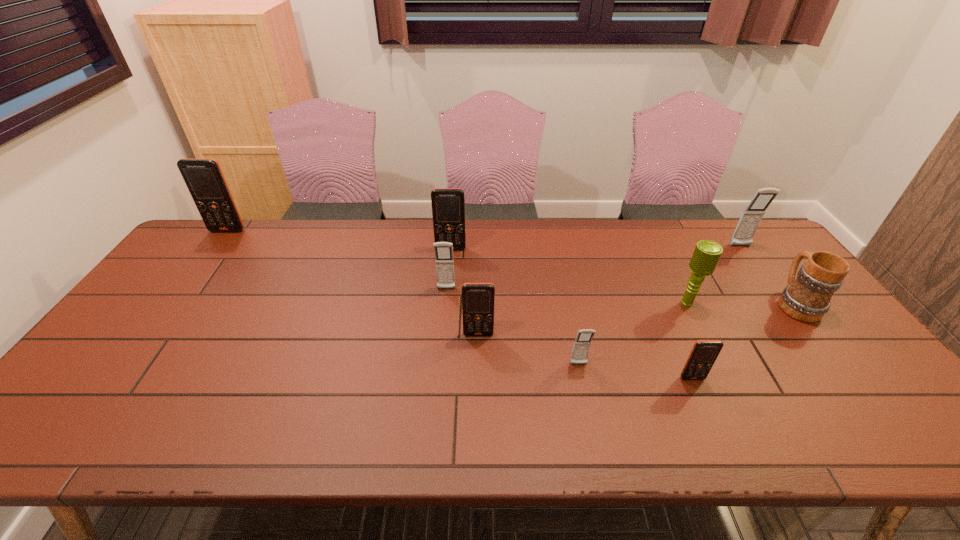
The height and width of the screenshot is (540, 960). In order to click on the third orange cellular telephone from left to right in this screenshot , I will do `click(478, 299)`.

Where is `mug`? The image size is (960, 540). mug is located at coordinates (807, 298).

I want to click on the rightmost orange cellular telephone, so click(704, 353).

Identify the location of the smallest orange cellular telephone. Image resolution: width=960 pixels, height=540 pixels. (704, 353).

What are the coordinates of `the smallest gray cellular telephone` in the screenshot? It's located at (582, 343).

You are a GUI agent. You are given a task and a screenshot of the screen. Output one action in this format:
    pyautogui.click(x=<x>, y=<y>)
    Task: Click on the fifth object from right to left
    This screenshot has width=960, height=540.
    Given the screenshot: What is the action you would take?
    pyautogui.click(x=582, y=343)

Identify the location of vacant space located 0.050m on the screen of the leftmost cellular telephone. This screenshot has width=960, height=540. (219, 242).

Where is `free space located on the front-facing side of the farthest gray cellular telephone`? This screenshot has height=540, width=960. free space located on the front-facing side of the farthest gray cellular telephone is located at coordinates click(795, 319).

Locate an element on the screen. Image resolution: width=960 pixels, height=540 pixels. free location located on the screen of the second farthest orange cellular telephone is located at coordinates (448, 275).

Identify the location of free space located 0.240m on the right of the seventh object from left to right. The height and width of the screenshot is (540, 960). (781, 304).